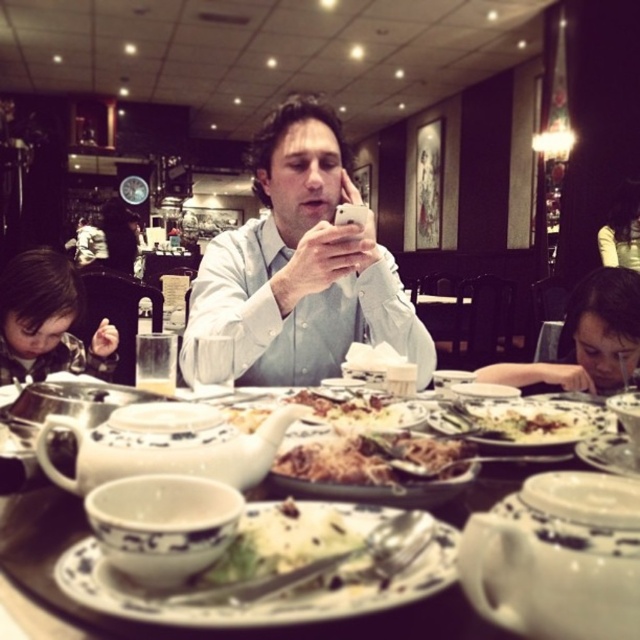
Question: Among these objects, which one is farthest from the camera?

Choices:
 (A) white porcelain plate at center
 (B) white creamy sauce at center
 (C) brown crispy noodles at center

Answer: (B)

Question: Can you confirm if white porcelain plate at center is wider than white ceramic plate at center?

Choices:
 (A) yes
 (B) no

Answer: (B)

Question: Is smooth brown hair at lower left further to camera compared to white creamy sauce at center?

Choices:
 (A) yes
 (B) no

Answer: (A)

Question: Which of the following is the farthest from the observer?

Choices:
 (A) brown matte noodles at center
 (B) brown crispy noodles at center
 (C) white porcelain plate at center

Answer: (B)

Question: Can you confirm if white porcelain plate at center is positioned to the left of brown crispy noodles at center?

Choices:
 (A) yes
 (B) no

Answer: (A)

Question: Which of the following is the farthest from the observer?

Choices:
 (A) white shirt at center
 (B) white porcelain tableware at center
 (C) brown crispy noodles at center
 (D) smooth brown hair at lower left

Answer: (D)